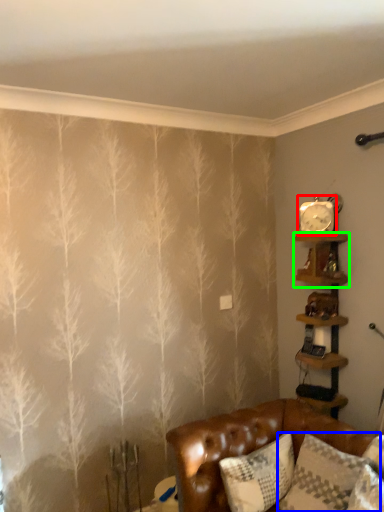
Question: Which object is the closest to the clock (highlighted by a red box)? Choose among these: pillow (highlighted by a blue box) or shelf (highlighted by a green box).

Choices:
 (A) pillow
 (B) shelf

Answer: (B)